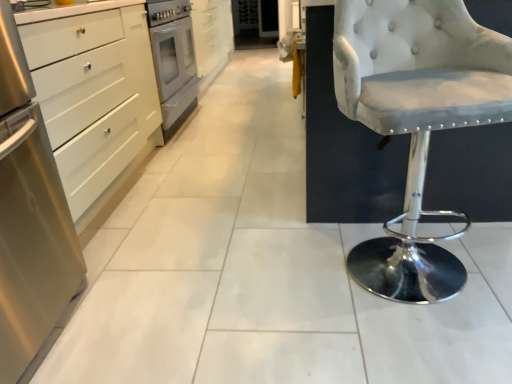
In order to click on blank area to the left of white tufted fabric stool at right in this screenshot , I will do `click(274, 291)`.